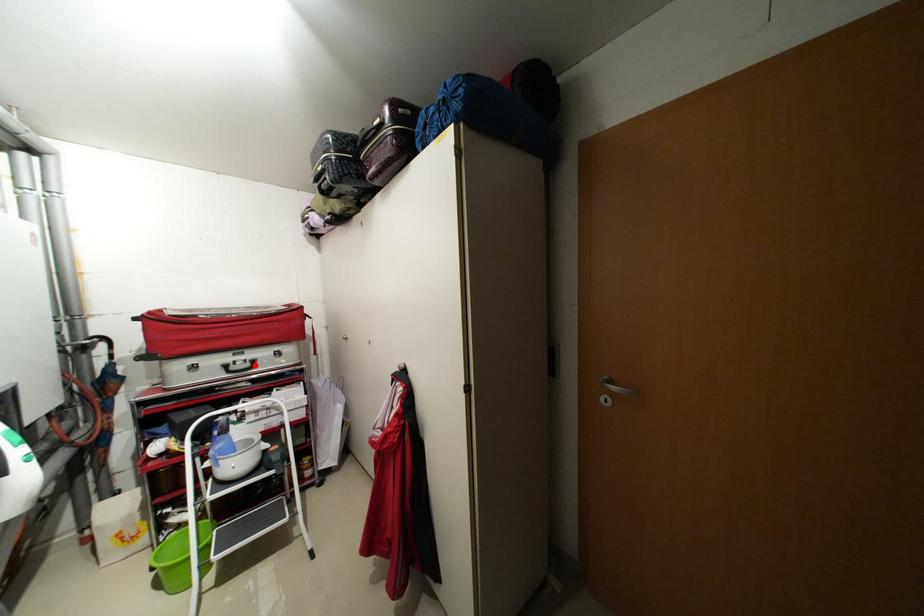
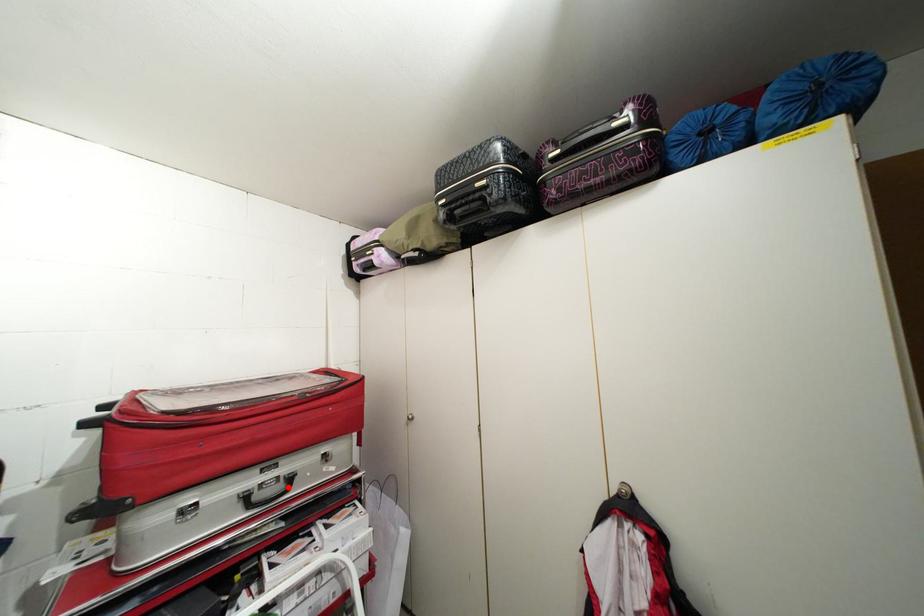
I am providing you with two images of the same scene from different viewpoints. A red point is marked on the first image and another point is marked on the second image. Does the point marked in image1 correspond to the same location as the one in image2?

Yes